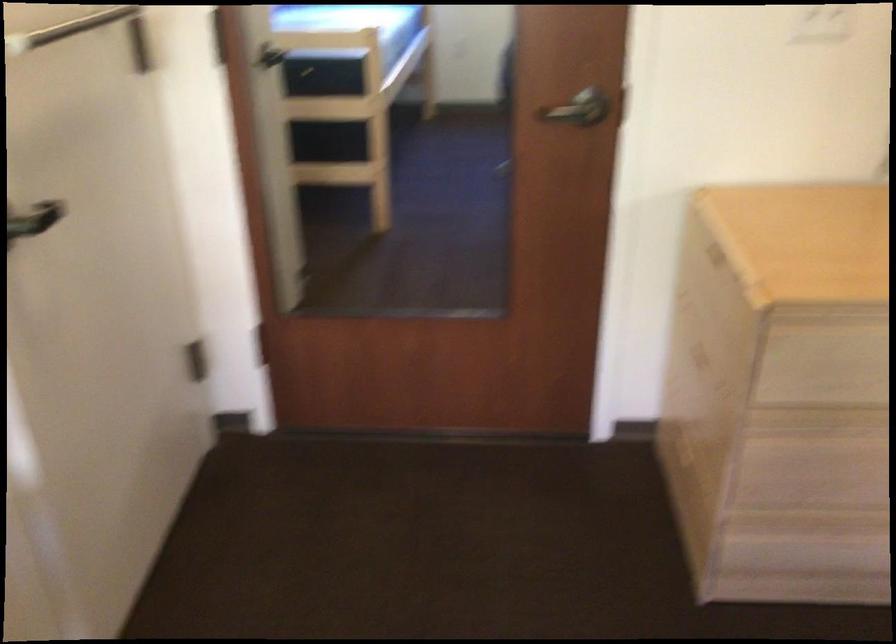
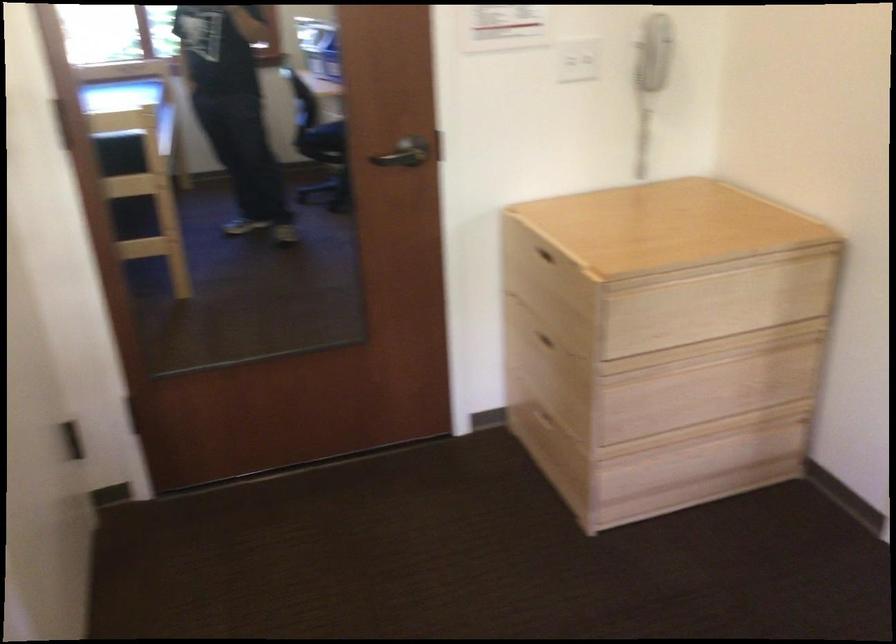
Question: Based on the continuous images, in which direction is the camera rotating? Reply with the corresponding letter.

Choices:
 (A) Left
 (B) Right
 (C) Up
 (D) Down

Answer: (B)